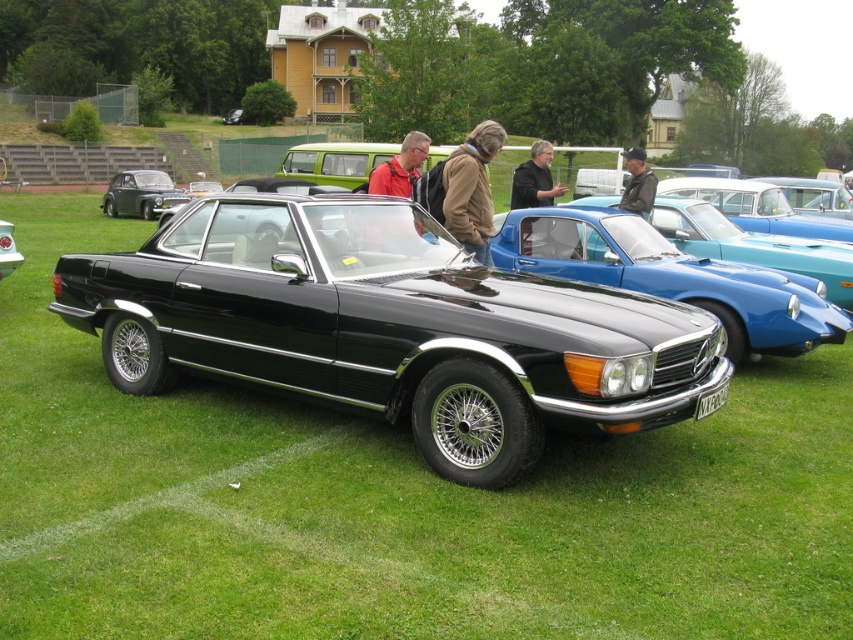
Can you confirm if black metallic car at center is bigger than shiny black car at center?

Yes.

Which is more to the right, black metallic car at center or shiny black car at center?

black metallic car at center

Between point (329, 248) and point (18, 260), which one is positioned in front?

Point (329, 248) is more forward.

This screenshot has height=640, width=853. I want to click on black metallic car at center, so click(x=390, y=326).

Can you confirm if black metallic car at center is positioned to the left of brown leather jacket at center?

Yes, black metallic car at center is to the left of brown leather jacket at center.

Who is shorter, black metallic car at center or brown leather jacket at center?

With less height is brown leather jacket at center.

Is point (491, 346) positioned in front of point (453, 218)?

Yes, it is.

Find the location of a particular element. This screenshot has width=853, height=640. black metallic car at center is located at coordinates (390, 326).

Does black metallic car at center appear under shiny black car at left?

Yes, black metallic car at center is below shiny black car at left.

Which is more to the left, black metallic car at center or shiny black car at left?

From the viewer's perspective, shiny black car at left appears more on the left side.

Does point (355, 266) come farther from viewer compared to point (149, 218)?

No, it is not.

Locate an element on the screen. This screenshot has height=640, width=853. black metallic car at center is located at coordinates (390, 326).